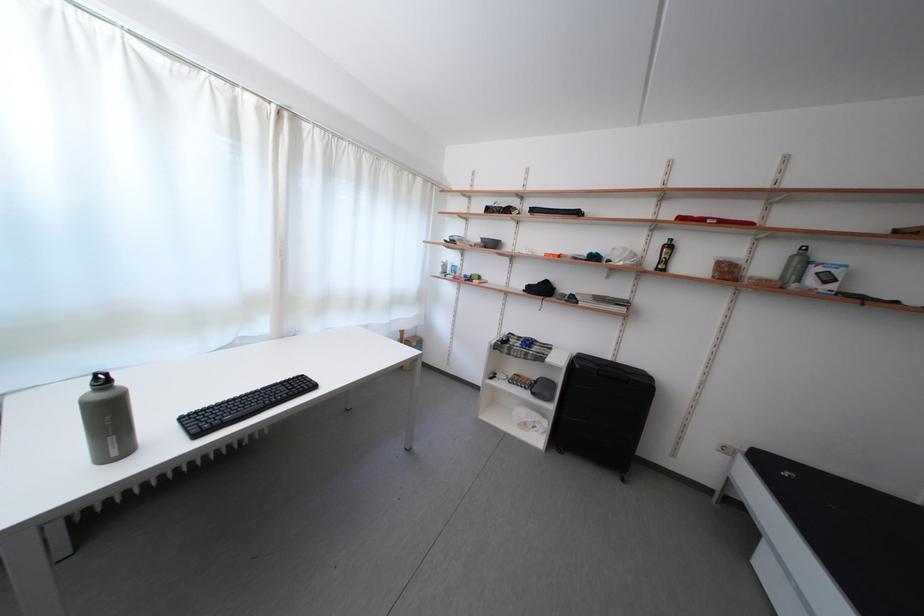
Find where to lift the plastic food container. Please return your answer as a coordinate pair (x, y).

(726, 269)